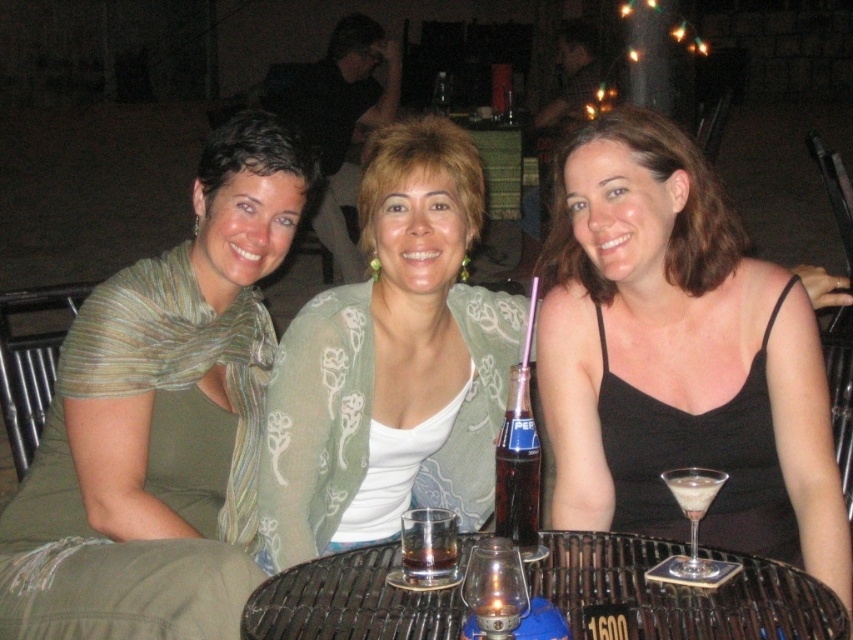
Question: Considering the real-world distances, which object is farthest from the black satin dress at center?

Choices:
 (A) clear glass bottle at center
 (B) clear glass at table center
 (C) wooden textured table at center
 (D) light green sheer cardigan at center

Answer: (B)

Question: Which point is closer to the camera?

Choices:
 (A) green textured scarf at center
 (B) black satin dress at center
 (C) light green sheer cardigan at center

Answer: (A)

Question: Does green textured scarf at center have a smaller size compared to clear glass bottle at center?

Choices:
 (A) yes
 (B) no

Answer: (B)

Question: Which object is farther from the camera taking this photo?

Choices:
 (A) clear glass bottle at center
 (B) green textured scarf at center
 (C) black satin dress at center
 (D) white creamy liquid at center

Answer: (C)

Question: Can you confirm if clear glass at table center is wider than white creamy liquid at center?

Choices:
 (A) yes
 (B) no

Answer: (B)

Question: Can you confirm if green textured scarf at center is wider than clear glass at table center?

Choices:
 (A) no
 (B) yes

Answer: (B)